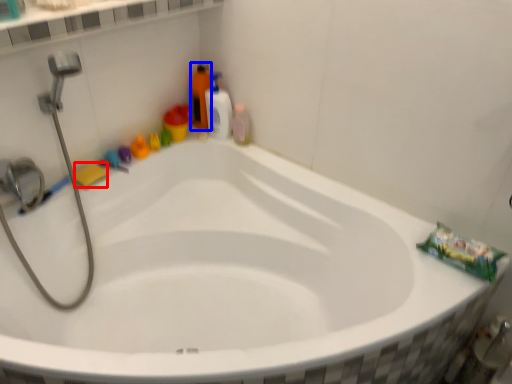
Question: Among these objects, which one is farthest to the camera, soap (highlighted by a red box) or cleaning product (highlighted by a blue box)?

Choices:
 (A) soap
 (B) cleaning product

Answer: (B)